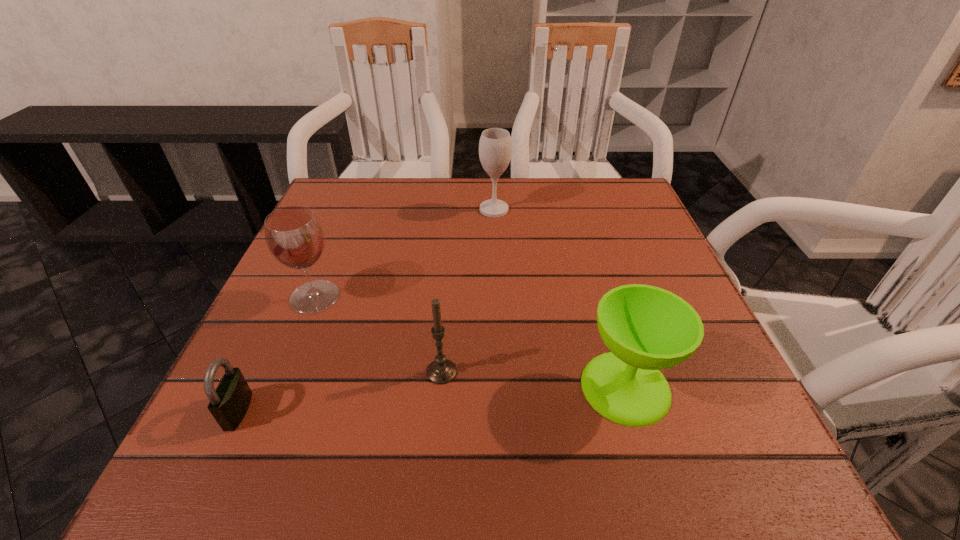
In the image, there is a desktop. Where is `free space at the near edge`? This screenshot has height=540, width=960. free space at the near edge is located at coordinates (444, 477).

In the image, there is a desktop. At what (x,y) coordinates should I click in order to perform the action: click on vacant space at the left edge. Please return your answer as a coordinate pair (x, y). Image resolution: width=960 pixels, height=540 pixels. Looking at the image, I should click on (317, 321).

In the image, there is a desktop. What are the coordinates of `vacant area at the right edge` in the screenshot? It's located at (703, 340).

This screenshot has height=540, width=960. In the image, there is a desktop. Find the location of `free space at the far left corner`. free space at the far left corner is located at coordinates (336, 227).

The image size is (960, 540). Find the location of `free space at the near left corner`. free space at the near left corner is located at coordinates (255, 492).

This screenshot has width=960, height=540. Identify the location of blank space at the near right corner of the desktop. (679, 482).

The image size is (960, 540). Identify the location of vacant space in between the leftmost wineglass and the candle. (378, 334).

This screenshot has height=540, width=960. I want to click on unoccupied position between the farthest object and the rightmost wineglass, so click(560, 298).

The width and height of the screenshot is (960, 540). I want to click on free space between the padlock and the third object from left to right, so click(340, 392).

Identify the location of blank region between the second object from right to left and the third object from right to left. (468, 291).